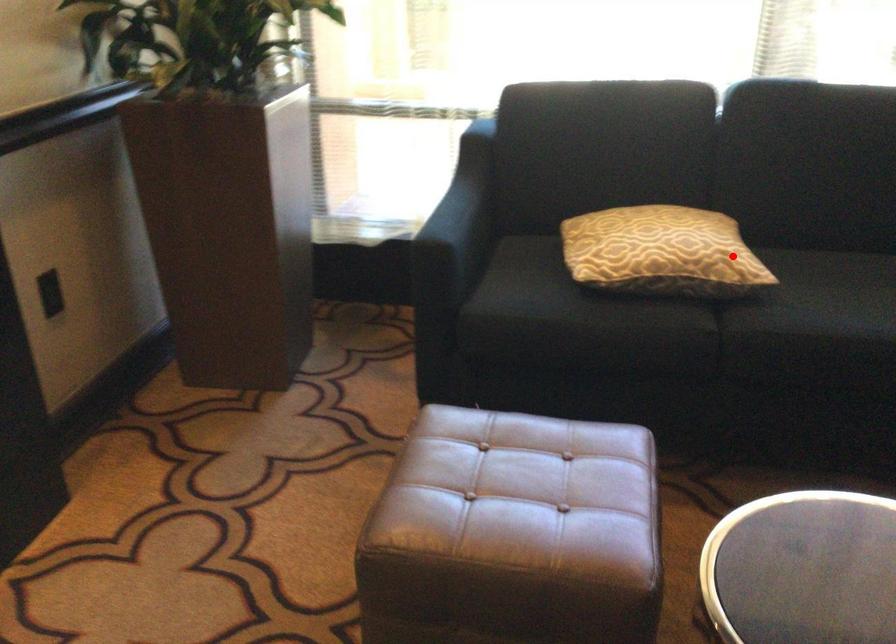
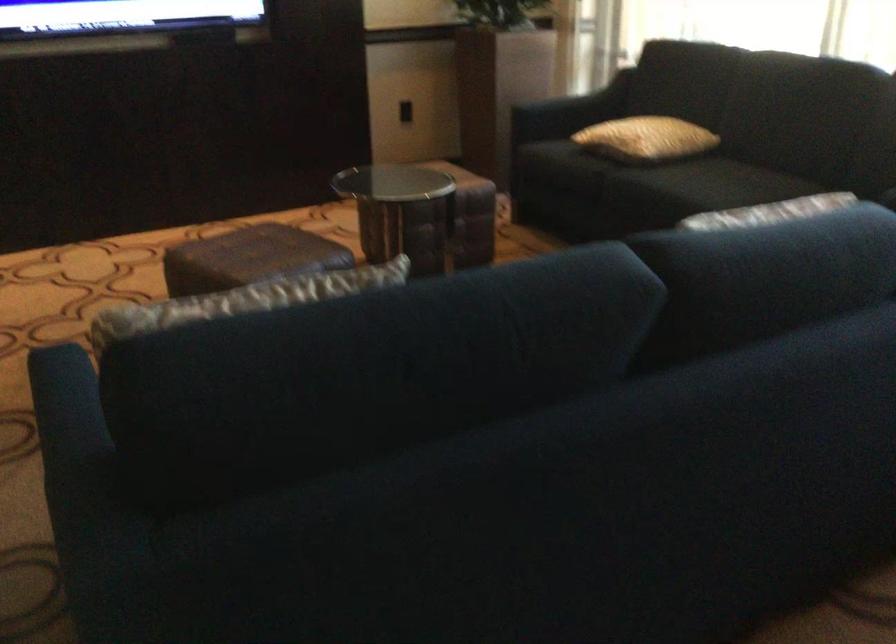
Where in the second image is the point corresponding to the highlighted location from the first image?

(645, 138)